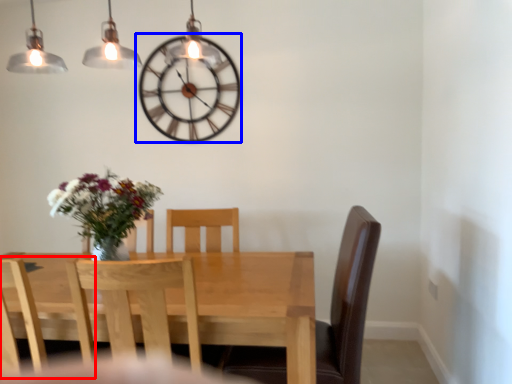
Question: Among these objects, which one is nearest to the camera, chair (highlighted by a red box) or wall clock (highlighted by a blue box)?

Choices:
 (A) chair
 (B) wall clock

Answer: (A)